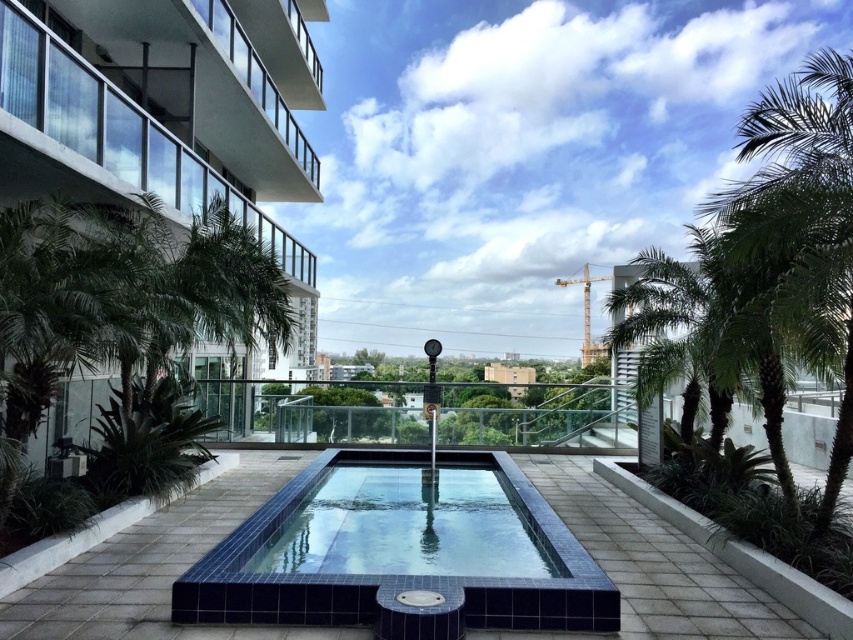
Question: Which point appears farthest from the camera in this image?

Choices:
 (A) (502, 456)
 (B) (514, 541)

Answer: (A)

Question: Is glassy concrete balcony at upper left to the right of blue glossy pool at center from the viewer's perspective?

Choices:
 (A) yes
 (B) no

Answer: (B)

Question: Is glassy concrete balcony at upper left above blue glossy pool at center?

Choices:
 (A) yes
 (B) no

Answer: (A)

Question: Which of these objects is positioned farthest from the blue glossy pool at center?

Choices:
 (A) blue tile swimming pool at center
 (B) glassy concrete balcony at upper left

Answer: (B)

Question: Which point is farther to the camera?

Choices:
 (A) blue glossy pool at center
 (B) glassy concrete balcony at upper left
 (C) blue tile swimming pool at center

Answer: (B)

Question: Does blue tile swimming pool at center have a lesser width compared to blue glossy pool at center?

Choices:
 (A) yes
 (B) no

Answer: (A)